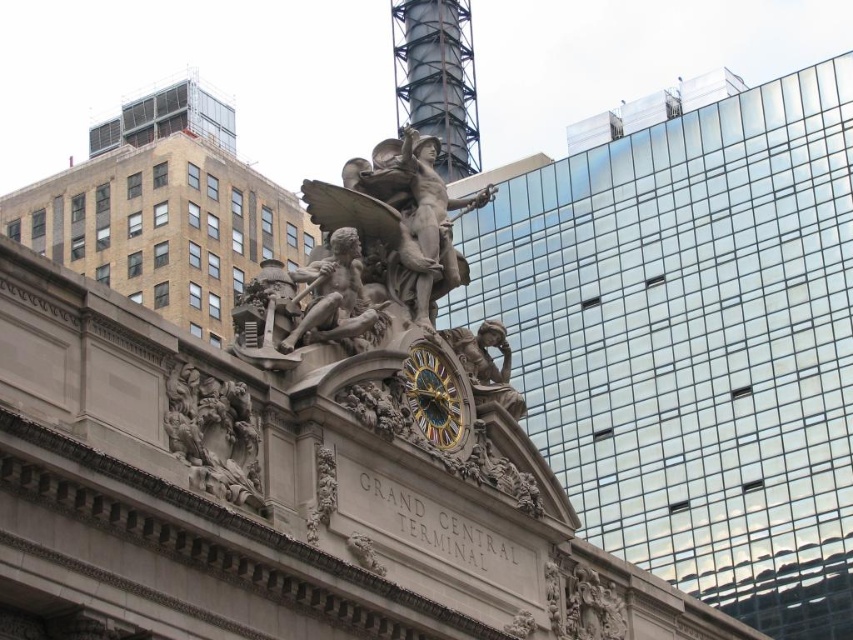
You are standing at the entrance of Grand Central Terminal and want to take a photo of both the polished bronze statue at center and the gold metallic clock at center in the same frame. Given that your camera has a maximum focus range of 15 feet, will you be able to capture both objects clearly in one shot?

The polished bronze statue at center is 15.17 feet away from the gold metallic clock at center. Since the distance between them exceeds the camera maximum focus range of 15 feet, you won t be able to capture both objects clearly in one shot.

What is the subject depicted in the carved stone relief located at the central point marked by coordinates point (213,435) on the Grand Central Terminal facade?

The carved stone relief at center marked by point (213,435) depicts a central male figure holding a torch, flanked by others representing themes of travel, commerce, or progress.